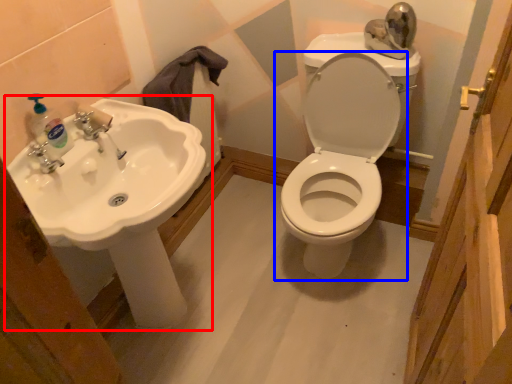
Question: Which of the following is the farthest to the observer, sink (highlighted by a red box) or toilet (highlighted by a blue box)?

Choices:
 (A) sink
 (B) toilet

Answer: (B)